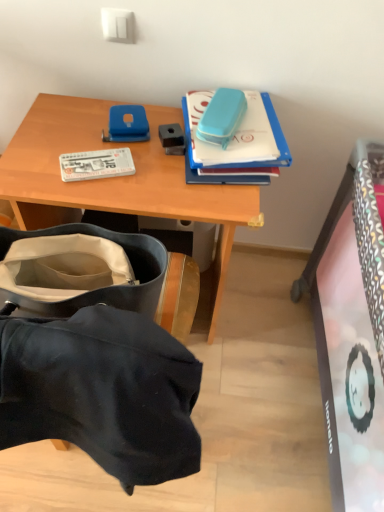
You are a GUI agent. You are given a task and a screenshot of the screen. Output one action in this format:
    pyautogui.click(x=<x>, y=<y>)
    Task: Click on the free location to the left of white matte book at left, the 1th book when ordered from left to right
    
    Given the screenshot: What is the action you would take?
    pyautogui.click(x=47, y=151)